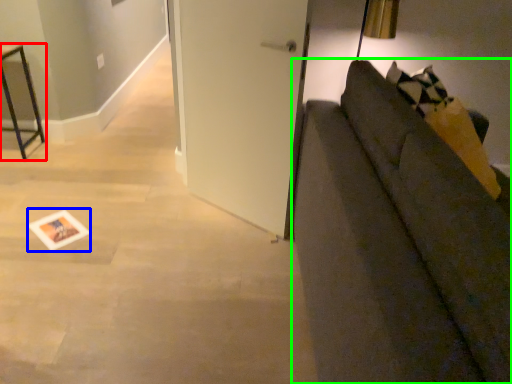
Question: Which is nearer to the furniture (highlighted by a red box)? postcard (highlighted by a blue box) or studio couch (highlighted by a green box).

Choices:
 (A) postcard
 (B) studio couch

Answer: (A)